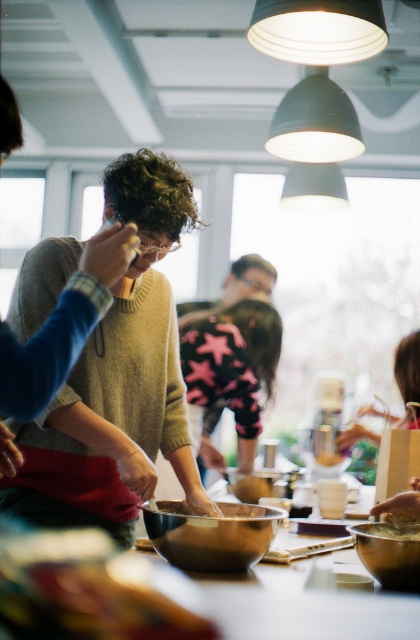
Question: Does shiny metallic bowl at center lie behind matte pink sweater at center?

Choices:
 (A) yes
 (B) no

Answer: (B)

Question: Estimate the real-world distances between objects in this image. Which object is farther from the pink star-patterned sweater at center?

Choices:
 (A) shiny metallic bowl at center
 (B) matte pink sweater at center
 (C) metallic bowl at lower center

Answer: (C)

Question: Is pink star-patterned sweater at center wider than matte pink sweater at center?

Choices:
 (A) no
 (B) yes

Answer: (B)

Question: Estimate the real-world distances between objects in this image. Which object is farther from the matte pink sweater at center?

Choices:
 (A) metallic bowl at lower center
 (B) shiny metallic bowl at center
 (C) pink star-patterned sweater at center

Answer: (A)

Question: Can you confirm if shiny metallic bowl at center is positioned below matte pink sweater at center?

Choices:
 (A) yes
 (B) no

Answer: (A)

Question: Which is farther from the metallic bowl at lower center?

Choices:
 (A) matte pink sweater at center
 (B) shiny metallic bowl at center

Answer: (A)